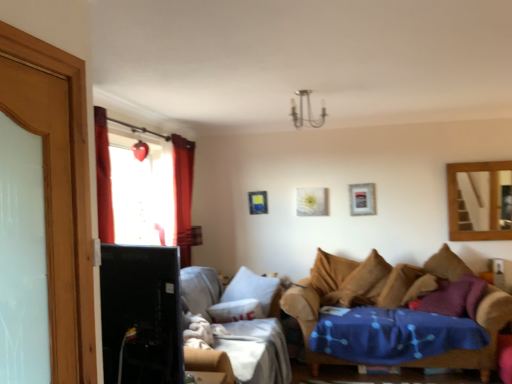
Question: Is brown fabric pillow at right, the second pillow in the right-to-left sequence, with purple soft pillow at right, acting as the 2th pillow starting from the left?

Choices:
 (A) yes
 (B) no

Answer: (B)

Question: From a real-world perspective, is brown fabric pillow at right, acting as the 1th pillow starting from the left, located higher than purple soft pillow at right, acting as the 2th pillow starting from the left?

Choices:
 (A) yes
 (B) no

Answer: (B)

Question: Is brown fabric pillow at right, the second pillow in the right-to-left sequence, surrounding purple soft pillow at right, the 1th pillow viewed from the right?

Choices:
 (A) no
 (B) yes

Answer: (A)

Question: Considering the relative sizes of brown fabric pillow at right, acting as the 1th pillow starting from the left, and purple soft pillow at right, acting as the 2th pillow starting from the left, in the image provided, is brown fabric pillow at right, acting as the 1th pillow starting from the left, shorter than purple soft pillow at right, acting as the 2th pillow starting from the left,?

Choices:
 (A) yes
 (B) no

Answer: (A)

Question: Is brown fabric pillow at right, the second pillow in the right-to-left sequence, thinner than purple soft pillow at right, acting as the 2th pillow starting from the left?

Choices:
 (A) yes
 (B) no

Answer: (B)

Question: Is brown fabric pillow at right, the second pillow in the right-to-left sequence, not inside purple soft pillow at right, the 1th pillow viewed from the right?

Choices:
 (A) no
 (B) yes

Answer: (B)

Question: From a real-world perspective, is wooden mirror at upper right positioned over black glossy tv at left based on gravity?

Choices:
 (A) no
 (B) yes

Answer: (B)

Question: Is wooden mirror at upper right turned away from black glossy tv at left?

Choices:
 (A) no
 (B) yes

Answer: (A)

Question: Is wooden mirror at upper right wider than black glossy tv at left?

Choices:
 (A) yes
 (B) no

Answer: (B)

Question: Does wooden mirror at upper right appear on the left side of black glossy tv at left?

Choices:
 (A) yes
 (B) no

Answer: (B)

Question: From a real-world perspective, does wooden mirror at upper right sit lower than black glossy tv at left?

Choices:
 (A) no
 (B) yes

Answer: (A)

Question: Is wooden mirror at upper right bigger than black glossy tv at left?

Choices:
 (A) yes
 (B) no

Answer: (B)

Question: Is matte blue picture frame at center, the first picture frame in the back-to-front sequence, located outside black glossy tv at left?

Choices:
 (A) yes
 (B) no

Answer: (A)